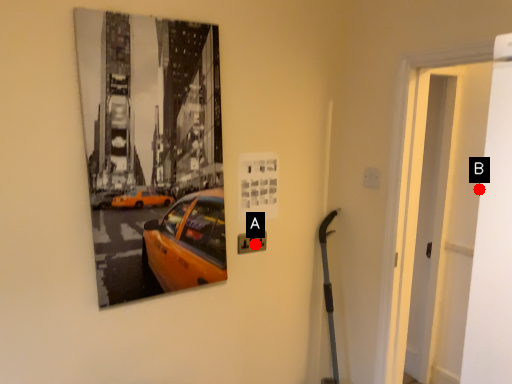
Question: Two points are circled on the image, labeled by A and B beside each circle. Among these points, which one is farthest from the camera?

Choices:
 (A) A is further
 (B) B is further

Answer: (B)